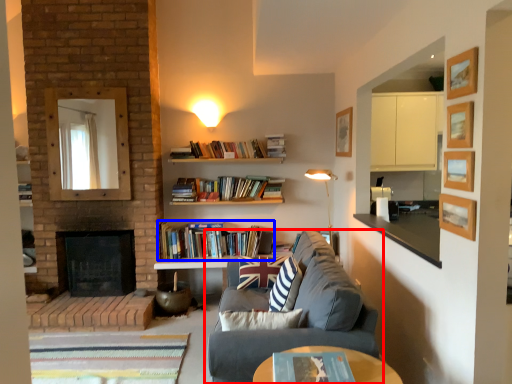
Question: Which object is closer to the camera taking this photo, studio couch (highlighted by a red box) or book (highlighted by a blue box)?

Choices:
 (A) studio couch
 (B) book

Answer: (A)